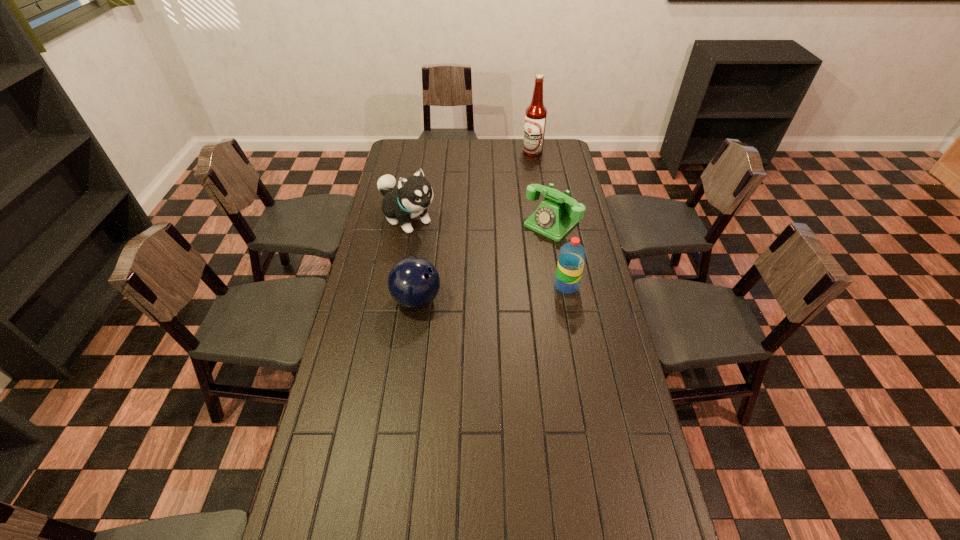
Find the location of a particular element. The width and height of the screenshot is (960, 540). water bottle located in the right edge section of the desktop is located at coordinates (572, 255).

I want to click on alcohol that is at the right edge, so click(x=536, y=113).

Image resolution: width=960 pixels, height=540 pixels. I want to click on telephone that is at the right edge, so click(554, 218).

Where is `object that is positioned at the far right corner`? object that is positioned at the far right corner is located at coordinates (536, 113).

Identify the location of vacant space at the far edge. The width and height of the screenshot is (960, 540). (430, 146).

Locate an element on the screen. This screenshot has width=960, height=540. free space at the near edge is located at coordinates (492, 501).

Where is `free spot at the left edge of the desktop`? The height and width of the screenshot is (540, 960). free spot at the left edge of the desktop is located at coordinates (337, 361).

This screenshot has height=540, width=960. What are the coordinates of `vacant space at the right edge of the desktop` in the screenshot? It's located at (579, 376).

Where is `vacant space that is in between the puppy and the water bottle`? The height and width of the screenshot is (540, 960). vacant space that is in between the puppy and the water bottle is located at coordinates (487, 252).

In order to click on unoccupied position between the puppy and the alcohol in this screenshot , I will do `click(470, 185)`.